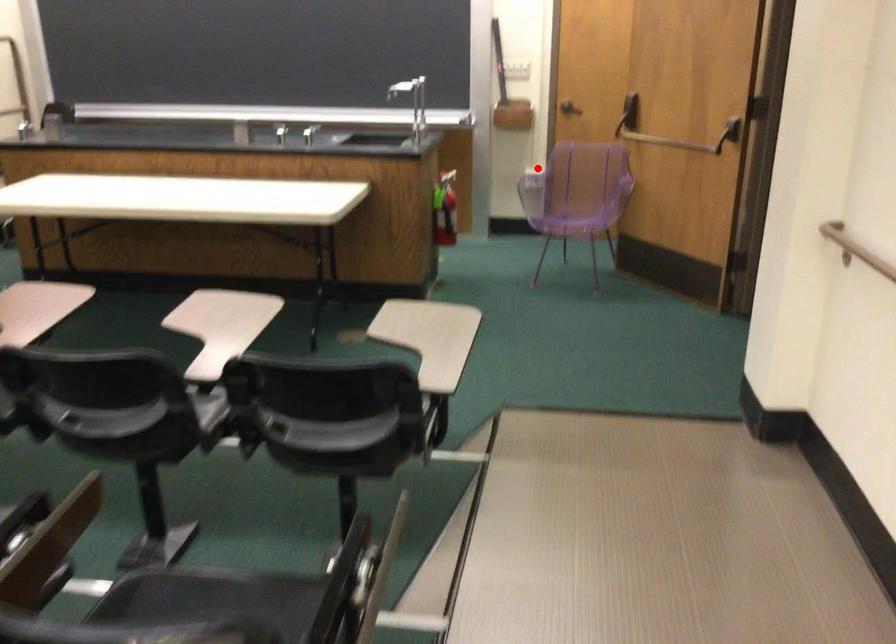
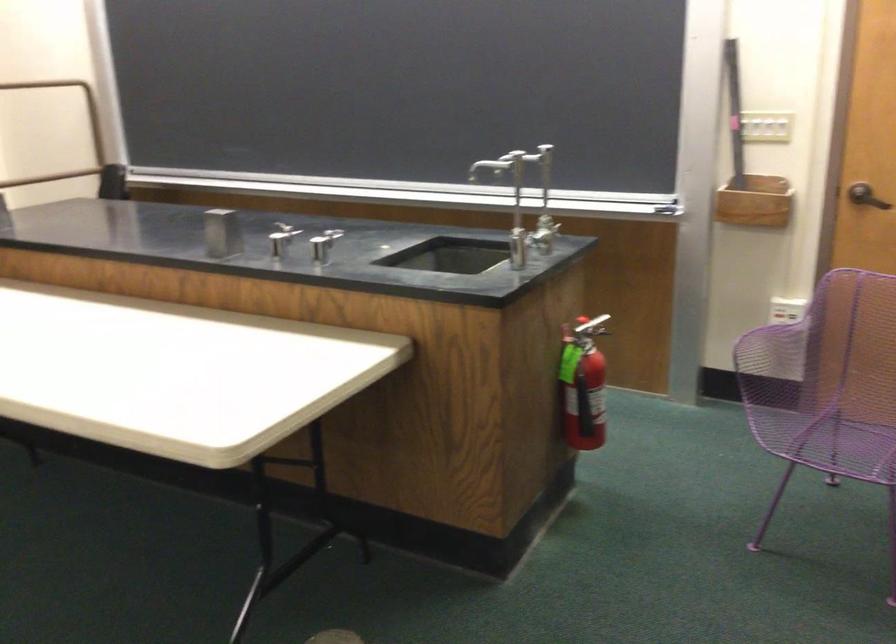
Question: I am providing you with two images of the same scene from different viewpoints. Image1 has a red point marked. In image2, the corresponding 3D location appears at what relative position? Reply with the corresponding letter.

Choices:
 (A) Closer
 (B) Farther

Answer: (A)